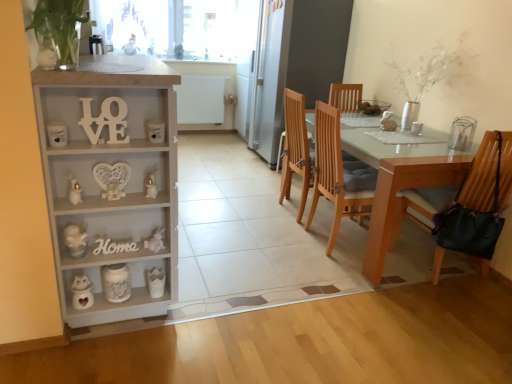
Question: Is point (123, 147) positioned closer to the camera than point (119, 107)?

Choices:
 (A) farther
 (B) closer

Answer: (A)

Question: Looking at the image, does white wood cabinet at left seem bigger or smaller compared to white wood love at left, which ranks as the first number in front-to-back order?

Choices:
 (A) small
 (B) big

Answer: (B)

Question: Which object is the closest to the transparent glass window screen at upper center?

Choices:
 (A) leather-like black bag at right, the 2th chair in the left-to-right sequence
 (B) white wood love at left, which is the first number from top to bottom
 (C) wooden sign at lower left, acting as the 2th number starting from the top
 (D) light brown wood chair at center, placed as the second chair when sorted from right to left
 (E) white wood cabinet at left

Answer: (D)

Question: Which of these objects is positioned farthest from the white wood cabinet at left?

Choices:
 (A) wooden sign at lower left, arranged as the 1th number when ordered from the bottom
 (B) light brown wood chair at center, acting as the 1th chair starting from the left
 (C) white wood love at left, which is the first number from top to bottom
 (D) white glass vase at upper right
 (E) transparent glass window screen at upper center

Answer: (E)